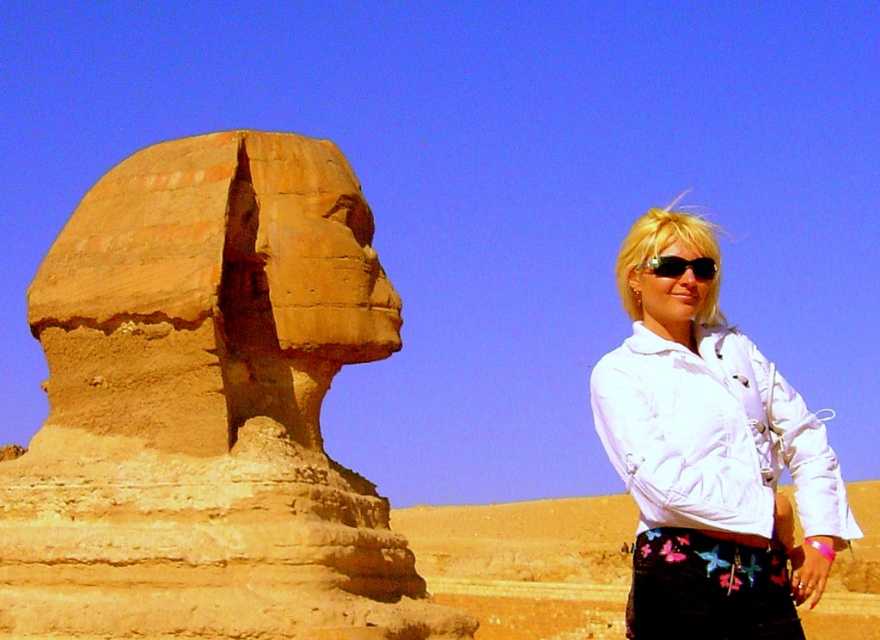
Is point (184, 200) less distant than point (737, 378)?

No, (184, 200) is further to viewer.

Does sandstone statue at left appear on the right side of white matte jacket at right?

In fact, sandstone statue at left is to the left of white matte jacket at right.

Consider the image. Measure the distance between point (304,365) and camera.

Point (304,365) and camera are 218.10 feet apart.

Find the location of a particular element. Image resolution: width=880 pixels, height=640 pixels. sandstone statue at left is located at coordinates (207, 410).

What do you see at coordinates (207, 410) in the screenshot? This screenshot has width=880, height=640. I see `sandstone statue at left` at bounding box center [207, 410].

In order to click on sandstone statue at left in this screenshot , I will do `click(207, 410)`.

Who is more forward, [156,496] or [657,268]?

Point [657,268]

At what (x,y) coordinates should I click in order to perform the action: click on sandstone statue at left. Please return your answer as a coordinate pair (x, y). The width and height of the screenshot is (880, 640). Looking at the image, I should click on (207, 410).

Which is in front, point (716, 499) or point (678, 257)?

Point (716, 499) is more forward.

This screenshot has height=640, width=880. What do you see at coordinates (709, 456) in the screenshot?
I see `white fabric jacket at right` at bounding box center [709, 456].

Locate an element on the screen. white fabric jacket at right is located at coordinates (709, 456).